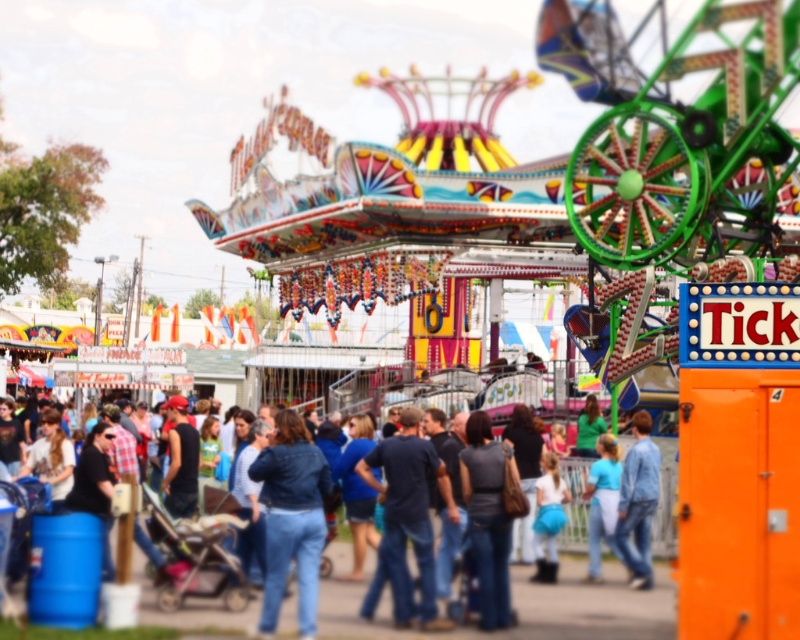
Question: Among these points, which one is nearest to the camera?

Choices:
 (A) (480, 419)
 (B) (424, 563)

Answer: (B)

Question: Which point is closer to the camera?

Choices:
 (A) (398, 548)
 (B) (281, 538)
 (C) (633, 449)

Answer: (B)

Question: Does jeans at center lie in front of denim jacket at center?

Choices:
 (A) yes
 (B) no

Answer: (A)

Question: Where is jeans at center located in relation to denim jacket at center in the image?

Choices:
 (A) left
 (B) right

Answer: (B)

Question: Is jeans at center bigger than denim jacket at center?

Choices:
 (A) no
 (B) yes

Answer: (B)

Question: Which object is the closest to the denim jacket at center?

Choices:
 (A) dark blue jeans at center
 (B) dark gray fabric shirt at center

Answer: (A)